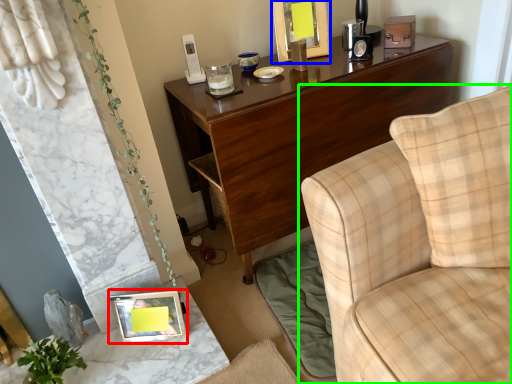
Question: Which is nearer to the picture frame (highlighted by a red box)? picture frame (highlighted by a blue box) or studio couch (highlighted by a green box).

Choices:
 (A) picture frame
 (B) studio couch

Answer: (B)